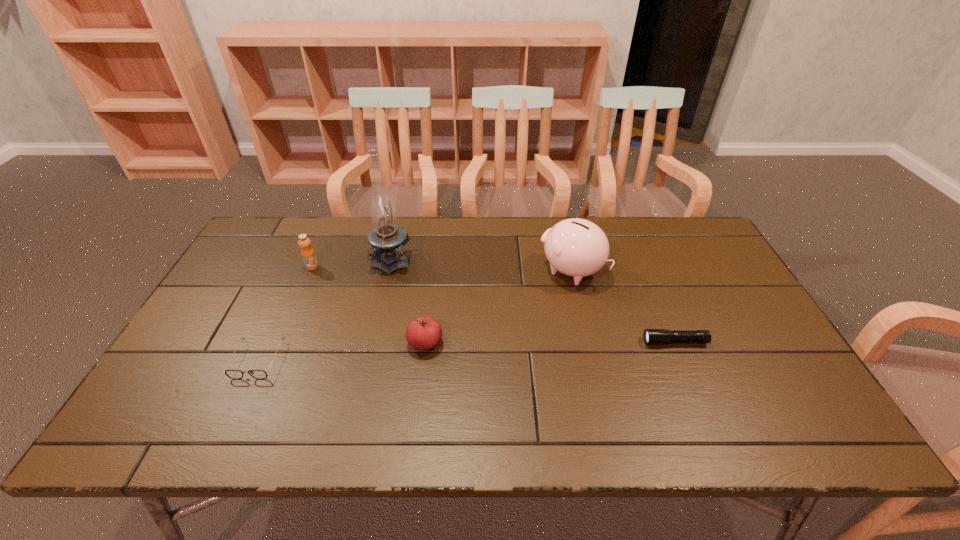
Locate an element on the screen. vacant area that lies between the fourth shortest object and the sunglasses is located at coordinates (285, 313).

Identify the location of unoccupied area between the piggy bank and the third tallest object. (442, 269).

Locate an element on the screen. The height and width of the screenshot is (540, 960). free space between the fifth shortest object and the orange juice is located at coordinates (442, 269).

Where is `blank region between the orange juice and the oil lamp`? This screenshot has width=960, height=540. blank region between the orange juice and the oil lamp is located at coordinates (352, 262).

This screenshot has width=960, height=540. I want to click on free space between the fifth object from left to right and the orange juice, so click(x=442, y=269).

Locate an element on the screen. The width and height of the screenshot is (960, 540). object that is the third closest one to the fifth object from left to right is located at coordinates (386, 238).

Select which object appears as the third closest to the tallest object. Please provide its 2D coordinates. Your answer should be formatted as a tuple, i.e. [(x, y)], where the tuple contains the x and y coordinates of a point satisfying the conditions above.

[(233, 374)]

At what (x,y) coordinates should I click in order to perform the action: click on vacant space that satisfies the following two spatial constraints: 1. at the lens end of the rightmost object; 2. on the front-facing side of the sunglasses. Please return your answer as a coordinate pair (x, y). The image size is (960, 540). Looking at the image, I should click on (683, 360).

At what (x,y) coordinates should I click in order to perform the action: click on free space that satisfies the following two spatial constraints: 1. on the front label of the fourth shortest object; 2. on the right side of the third shortest object. Please return your answer as a coordinate pair (x, y). Image resolution: width=960 pixels, height=540 pixels. Looking at the image, I should click on (279, 342).